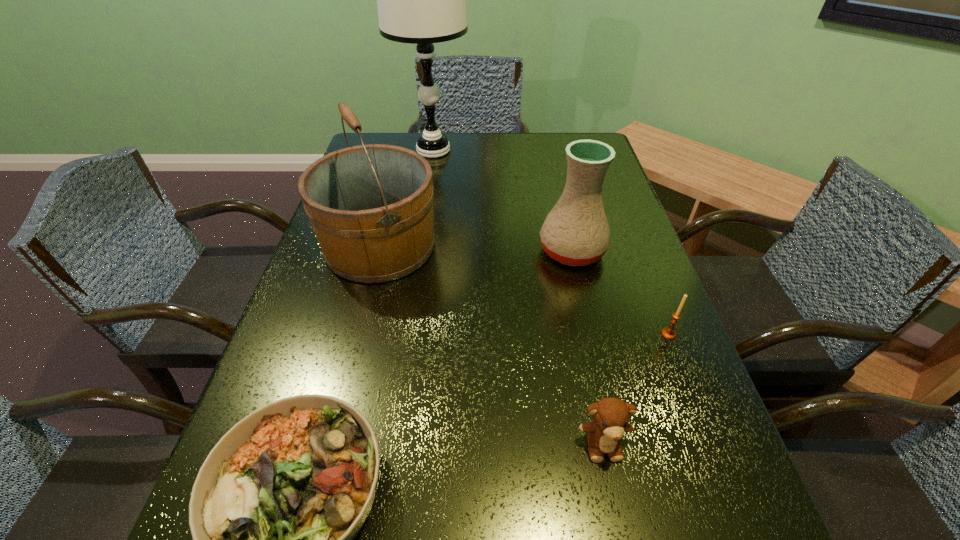
This screenshot has height=540, width=960. I want to click on table lamp, so click(x=421, y=0).

Image resolution: width=960 pixels, height=540 pixels. Find the location of `the tallest object`. the tallest object is located at coordinates [421, 0].

Locate an element on the screen. The height and width of the screenshot is (540, 960). the second tallest object is located at coordinates tap(371, 206).

Locate an element on the screen. The image size is (960, 540). pottery is located at coordinates (576, 232).

The height and width of the screenshot is (540, 960). In order to click on the rightmost object in this screenshot , I will do `click(668, 332)`.

I want to click on candle_holder, so click(668, 332).

Locate an element on the screen. The image size is (960, 540). teddy bear is located at coordinates (611, 416).

I want to click on vacant space situated on the right of the tallest object, so click(514, 151).

The height and width of the screenshot is (540, 960). What are the coordinates of `free location located on the right of the bucket` in the screenshot? It's located at (495, 246).

Where is `free space located 0.190m on the front of the pottery`? The height and width of the screenshot is (540, 960). free space located 0.190m on the front of the pottery is located at coordinates (x=592, y=341).